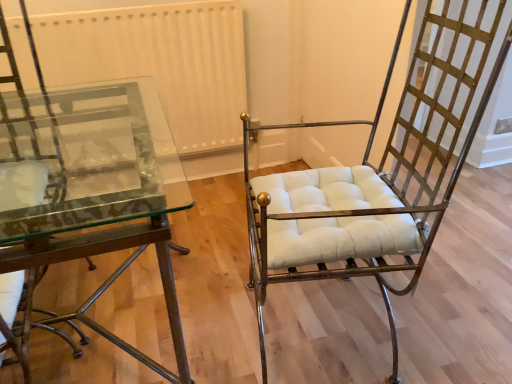
Identify the location of white textured radiator at upper center. (159, 61).

Measure the distance between white textured radiator at upper center and camera.

1.68 meters.

In order to face clear glass table at left, should I rotate leftwards or rightwards?

You should look left and rotate roughly 24.231 degrees.

The width and height of the screenshot is (512, 384). Identify the location of white textured radiator at upper center. (159, 61).

Is gold textured metal chair at right, placed as the 2th chair when sorted from left to right, smaller than metallic glass table at left, acting as the 1th chair starting from the left?

Incorrect, gold textured metal chair at right, placed as the 2th chair when sorted from left to right, is not smaller in size than metallic glass table at left, acting as the 1th chair starting from the left.

From a real-world perspective, between gold textured metal chair at right, the first chair when ordered from right to left, and metallic glass table at left, which appears as the second chair when viewed from the right, who is vertically lower?

From a 3D spatial view, metallic glass table at left, which appears as the second chair when viewed from the right, is below.

Does point (257, 188) come in front of point (74, 345)?

Yes.

Is there a large distance between clear glass table at left and white textured radiator at upper center?

No, clear glass table at left is not far from white textured radiator at upper center.

Is point (104, 139) less distant than point (196, 98)?

Yes, point (104, 139) is in front of point (196, 98).

Does clear glass table at left have a smaller size compared to white textured radiator at upper center?

Incorrect, clear glass table at left is not smaller in size than white textured radiator at upper center.

Who is smaller, clear glass table at left or metallic glass table at left, which appears as the second chair when viewed from the right?

metallic glass table at left, which appears as the second chair when viewed from the right.

Is clear glass table at left positioned beyond the bounds of metallic glass table at left, acting as the 1th chair starting from the left?

Yes, clear glass table at left is not within metallic glass table at left, acting as the 1th chair starting from the left.

Does clear glass table at left have a greater width compared to metallic glass table at left, acting as the 1th chair starting from the left?

Indeed, clear glass table at left has a greater width compared to metallic glass table at left, acting as the 1th chair starting from the left.

Which is in front, point (102, 93) or point (61, 188)?

The point (102, 93) is closer to the camera.

Considering the sizes of objects gold textured metal chair at right, placed as the 2th chair when sorted from left to right, and clear glass table at left in the image provided, who is bigger, gold textured metal chair at right, placed as the 2th chair when sorted from left to right, or clear glass table at left?

clear glass table at left.

From the image's perspective, which is above, gold textured metal chair at right, the first chair when ordered from right to left, or clear glass table at left?

gold textured metal chair at right, the first chair when ordered from right to left, appears higher in the image.

Does gold textured metal chair at right, the first chair when ordered from right to left, turn towards clear glass table at left?

No, gold textured metal chair at right, the first chair when ordered from right to left, does not turn towards clear glass table at left.

Which object is positioned more to the right, gold textured metal chair at right, the first chair when ordered from right to left, or clear glass table at left?

Positioned to the right is gold textured metal chair at right, the first chair when ordered from right to left.

Is white textured radiator at upper center positioned beyond the bounds of gold textured metal chair at right, placed as the 2th chair when sorted from left to right?

Yes, white textured radiator at upper center is not within gold textured metal chair at right, placed as the 2th chair when sorted from left to right.

Can you confirm if white textured radiator at upper center is smaller than gold textured metal chair at right, the first chair when ordered from right to left?

Correct, white textured radiator at upper center occupies less space than gold textured metal chair at right, the first chair when ordered from right to left.

In the scene shown: Would you say white textured radiator at upper center is a long distance from gold textured metal chair at right, the first chair when ordered from right to left?

No.

Which of these two, white textured radiator at upper center or metallic glass table at left, which appears as the second chair when viewed from the right, is smaller?

Smaller between the two is white textured radiator at upper center.

Is white textured radiator at upper center shorter than metallic glass table at left, which appears as the second chair when viewed from the right?

Yes, white textured radiator at upper center is shorter than metallic glass table at left, which appears as the second chair when viewed from the right.

Considering the relative sizes of white textured radiator at upper center and metallic glass table at left, which appears as the second chair when viewed from the right, in the image provided, is white textured radiator at upper center thinner than metallic glass table at left, which appears as the second chair when viewed from the right,?

Correct, the width of white textured radiator at upper center is less than that of metallic glass table at left, which appears as the second chair when viewed from the right.

Is white textured radiator at upper center outside of metallic glass table at left, acting as the 1th chair starting from the left?

That's correct, white textured radiator at upper center is outside of metallic glass table at left, acting as the 1th chair starting from the left.

In the image, is metallic glass table at left, acting as the 1th chair starting from the left, on the left side or the right side of clear glass table at left?

metallic glass table at left, acting as the 1th chair starting from the left, is positioned on clear glass table at left's left side.

Is metallic glass table at left, which appears as the second chair when viewed from the right, inside or outside of clear glass table at left?

metallic glass table at left, which appears as the second chair when viewed from the right, can be found inside clear glass table at left.

Is metallic glass table at left, which appears as the second chair when viewed from the right, positioned with its back to clear glass table at left?

Absolutely, metallic glass table at left, which appears as the second chair when viewed from the right, is directed away from clear glass table at left.

From a real-world perspective, is metallic glass table at left, which appears as the second chair when viewed from the right, positioned under clear glass table at left based on gravity?

No.

The width and height of the screenshot is (512, 384). What are the coordinates of `chair to the left of gold textured metal chair at right, the first chair when ordered from right to left` in the screenshot? It's located at (19, 153).

Locate an element on the screen. The image size is (512, 384). radiator located above the clear glass table at left (from the image's perspective) is located at coordinates (159, 61).

Considering their positions, is gold textured metal chair at right, the first chair when ordered from right to left, positioned closer to clear glass table at left than metallic glass table at left, which appears as the second chair when viewed from the right?

metallic glass table at left, which appears as the second chair when viewed from the right.

Estimate the real-world distances between objects in this image. Which object is closer to gold textured metal chair at right, placed as the 2th chair when sorted from left to right, white textured radiator at upper center or clear glass table at left?

clear glass table at left is closer to gold textured metal chair at right, placed as the 2th chair when sorted from left to right.

From the image, which object appears to be farther from clear glass table at left, metallic glass table at left, acting as the 1th chair starting from the left, or gold textured metal chair at right, the first chair when ordered from right to left?

Based on the image, gold textured metal chair at right, the first chair when ordered from right to left, appears to be further to clear glass table at left.

Based on their spatial positions, is gold textured metal chair at right, placed as the 2th chair when sorted from left to right, or white textured radiator at upper center closer to metallic glass table at left, acting as the 1th chair starting from the left?

Among the two, white textured radiator at upper center is located nearer to metallic glass table at left, acting as the 1th chair starting from the left.

Which object lies further to the anchor point metallic glass table at left, acting as the 1th chair starting from the left, clear glass table at left or gold textured metal chair at right, placed as the 2th chair when sorted from left to right?

The object further to metallic glass table at left, acting as the 1th chair starting from the left, is gold textured metal chair at right, placed as the 2th chair when sorted from left to right.

When comparing their distances from clear glass table at left, does gold textured metal chair at right, placed as the 2th chair when sorted from left to right, or white textured radiator at upper center seem further?

The object further to clear glass table at left is gold textured metal chair at right, placed as the 2th chair when sorted from left to right.

Looking at this image, estimate the real-world distances between objects in this image. Which object is further from gold textured metal chair at right, placed as the 2th chair when sorted from left to right, metallic glass table at left, acting as the 1th chair starting from the left, or white textured radiator at upper center?

Among the two, metallic glass table at left, acting as the 1th chair starting from the left, is located further to gold textured metal chair at right, placed as the 2th chair when sorted from left to right.

When comparing their distances from clear glass table at left, does white textured radiator at upper center or metallic glass table at left, acting as the 1th chair starting from the left, seem further?

Among the two, white textured radiator at upper center is located further to clear glass table at left.

Image resolution: width=512 pixels, height=384 pixels. Find the location of `table situated between metallic glass table at left, which appears as the second chair when viewed from the right, and gold textured metal chair at right, placed as the 2th chair when sorted from left to right, from left to right`. table situated between metallic glass table at left, which appears as the second chair when viewed from the right, and gold textured metal chair at right, placed as the 2th chair when sorted from left to right, from left to right is located at coordinates (108, 197).

In order to click on chair located between metallic glass table at left, acting as the 1th chair starting from the left, and white textured radiator at upper center in the depth direction in this screenshot , I will do `click(373, 179)`.

You are a GUI agent. You are given a task and a screenshot of the screen. Output one action in this format:
    pyautogui.click(x=<x>, y=<y>)
    Task: Click on the table between metallic glass table at left, which appears as the second chair when viewed from the right, and white textured radiator at upper center in the front-back direction
    
    Given the screenshot: What is the action you would take?
    pyautogui.click(x=108, y=197)

Locate an element on the screen. This screenshot has height=384, width=512. chair between clear glass table at left and white textured radiator at upper center from front to back is located at coordinates (373, 179).